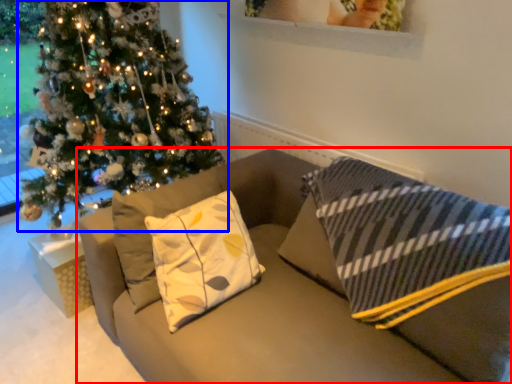
Question: Which point is closer to the camera, studio couch (highlighted by a red box) or christmas tree (highlighted by a blue box)?

Choices:
 (A) studio couch
 (B) christmas tree

Answer: (A)